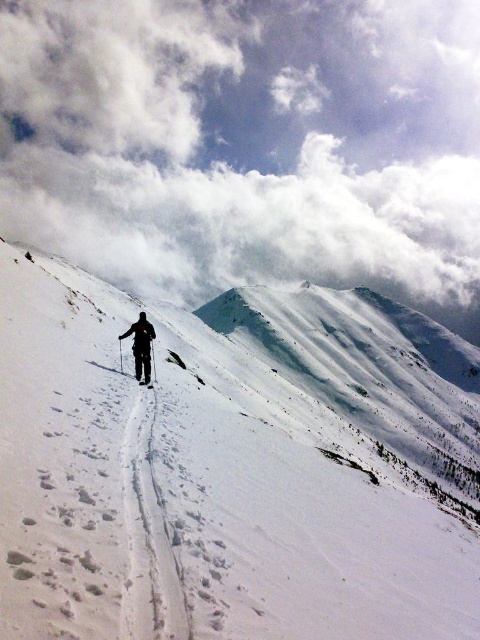
Does white snow ski slope at center have a smaller size compared to dark gray ski suit at center?

Incorrect, white snow ski slope at center is not smaller in size than dark gray ski suit at center.

Is point (12, 621) positioned behind point (122, 337)?

No.

The width and height of the screenshot is (480, 640). I want to click on white snow ski slope at center, so click(195, 490).

Which is in front, point (144, 460) or point (142, 380)?

Point (144, 460) is in front.

This screenshot has height=640, width=480. What do you see at coordinates (195, 490) in the screenshot?
I see `white snow ski slope at center` at bounding box center [195, 490].

The width and height of the screenshot is (480, 640). I want to click on white snow ski slope at center, so click(195, 490).

From the picture: Is dark gray ski suit at center positioned behind white matte ski at center?

That is True.

Can you confirm if dark gray ski suit at center is positioned to the right of white matte ski at center?

No, dark gray ski suit at center is not to the right of white matte ski at center.

Find the location of `dark gray ski suit at center`. dark gray ski suit at center is located at coordinates (141, 344).

The height and width of the screenshot is (640, 480). Find the location of `dark gray ski suit at center`. dark gray ski suit at center is located at coordinates (141, 344).